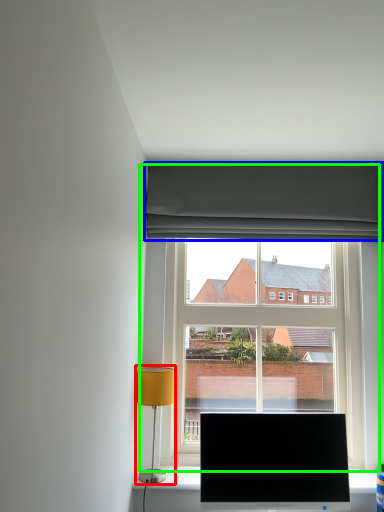
Question: Which is nearer to the table lamp (highlighted by a red box)? curtain (highlighted by a blue box) or window (highlighted by a green box).

Choices:
 (A) curtain
 (B) window

Answer: (B)